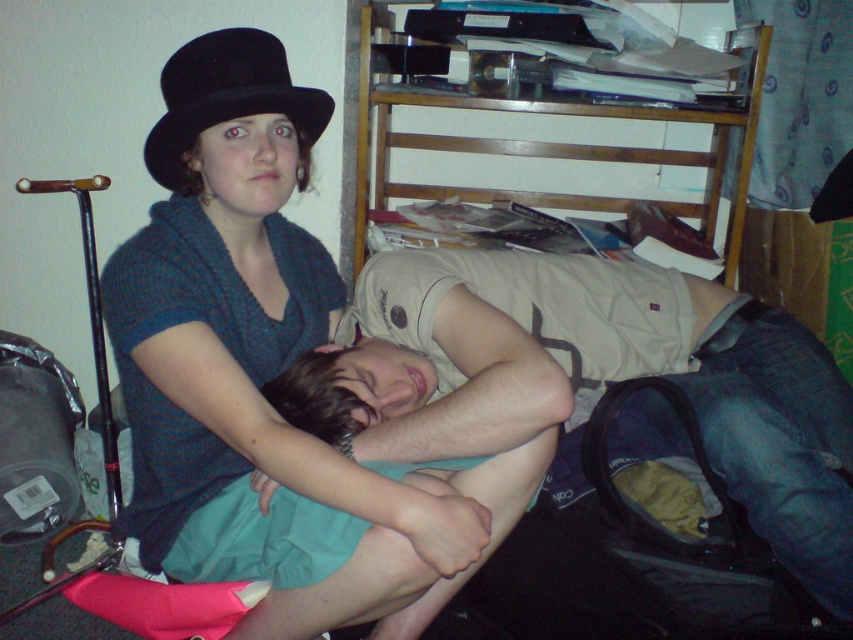
You are designing a display case for a fashion exhibit. The case has a shelf that can only accommodate items narrower than the light beige cotton shirt at center. Can the matte black hat at upper left fit on this shelf?

The matte black hat at upper left is narrower than the light beige cotton shirt at center, so it can fit on the shelf.

You are standing in the room and want to place a small decorative item exactly at the position where the matte black hat at upper left is currently located. According to the coordinates provided, where should you place the item?

The matte black hat at upper left is located at point [270,378], so you should place the decorative item at those coordinates.

You are a tailor measuring the distance between the matte black hat at upper left and the light beige cotton shirt at center for a custom fitting. The minimum required distance for accurate measurements is 20 centimeters. Can you proceed with the measurements as they are?

The distance between the matte black hat at upper left and the light beige cotton shirt at center is 19.15 centimeters, which is less than the required 20 centimeters. Therefore, you cannot proceed with the measurements as they are.